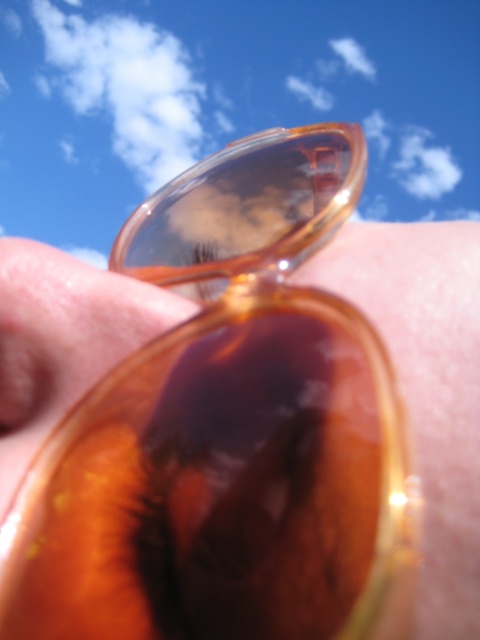
Is translucent amber sunglasses at center in front of translucent amber lens at center?

That is True.

Between translucent amber sunglasses at center and translucent amber lens at center, which one appears on the left side from the viewer's perspective?

translucent amber lens at center is more to the left.

Is point (31, 250) in front of point (310, 168)?

Yes, point (31, 250) is closer to viewer.

Locate an element on the screen. Image resolution: width=480 pixels, height=640 pixels. translucent amber sunglasses at center is located at coordinates (427, 385).